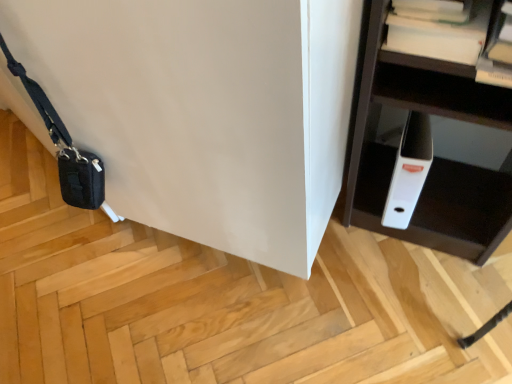
Where is `white paper at upper right`? The height and width of the screenshot is (384, 512). white paper at upper right is located at coordinates (440, 36).

Describe the element at coordinates (440, 36) in the screenshot. The image size is (512, 384). I see `white paper at upper right` at that location.

The width and height of the screenshot is (512, 384). What do you see at coordinates (64, 147) in the screenshot?
I see `black fabric messenger bag at lower left` at bounding box center [64, 147].

Locate an element on the screen. This screenshot has width=512, height=384. black fabric messenger bag at lower left is located at coordinates (64, 147).

What is the approximate width of black fabric messenger bag at lower left?

The width of black fabric messenger bag at lower left is 3.83 inches.

Measure the distance between black fabric messenger bag at lower left and camera.

A distance of 29.37 inches exists between black fabric messenger bag at lower left and camera.

I want to click on white paper at upper right, so click(440, 36).

Is white paper at upper right to the right of black fabric messenger bag at lower left from the viewer's perspective?

Yes, white paper at upper right is to the right of black fabric messenger bag at lower left.

Does white paper at upper right come in front of black fabric messenger bag at lower left?

Yes.

Between point (472, 2) and point (68, 132), which one is positioned in front?

The point (472, 2) is more forward.

From the image's perspective, is white paper at upper right positioned above or below black fabric messenger bag at lower left?

From the image's perspective, white paper at upper right appears above black fabric messenger bag at lower left.

From a real-world perspective, is white paper at upper right located higher than black fabric messenger bag at lower left?

Yes, from a real-world perspective, white paper at upper right is on top of black fabric messenger bag at lower left.

Which of these two, white paper at upper right or black fabric messenger bag at lower left, is wider?

white paper at upper right.

Consider the image. Considering the relative sizes of white paper at upper right and black fabric messenger bag at lower left in the image provided, is white paper at upper right taller than black fabric messenger bag at lower left?

Incorrect, the height of white paper at upper right is not larger of that of black fabric messenger bag at lower left.

Can you confirm if white paper at upper right is smaller than black fabric messenger bag at lower left?

Yes, white paper at upper right is smaller than black fabric messenger bag at lower left.

Based on the photo, can black fabric messenger bag at lower left be found inside white paper at upper right?

That's incorrect, black fabric messenger bag at lower left is not inside white paper at upper right.

Is there a large distance between white paper at upper right and black fabric messenger bag at lower left?

No, white paper at upper right is not far away from black fabric messenger bag at lower left.

Is white paper at upper right aimed at black fabric messenger bag at lower left?

No, white paper at upper right is not oriented towards black fabric messenger bag at lower left.

What's the angular difference between white paper at upper right and black fabric messenger bag at lower left's facing directions?

The angle between the facing direction of white paper at upper right and the facing direction of black fabric messenger bag at lower left is 24 degrees.

Find the location of a particular element. This screenshot has height=384, width=512. messenger bag located on the left of white paper at upper right is located at coordinates (64, 147).

Does black fabric messenger bag at lower left appear on the left side of white paper at upper right?

Yes.

Is black fabric messenger bag at lower left positioned before white paper at upper right?

No, the depth of black fabric messenger bag at lower left is greater than that of white paper at upper right.

Considering the points (48, 121) and (417, 32), which point is behind, point (48, 121) or point (417, 32)?

The point (48, 121) is farther from the camera.

From the image's perspective, which one is positioned lower, black fabric messenger bag at lower left or white paper at upper right?

black fabric messenger bag at lower left is shown below in the image.

From a real-world perspective, which object rests below the other?

In real-world perspective, black fabric messenger bag at lower left is lower.

Is black fabric messenger bag at lower left thinner than white paper at upper right?

Yes.

Does black fabric messenger bag at lower left have a greater height compared to white paper at upper right?

Yes.

Can you confirm if black fabric messenger bag at lower left is smaller than white paper at upper right?

No, black fabric messenger bag at lower left is not smaller than white paper at upper right.

Would you say black fabric messenger bag at lower left is inside or outside white paper at upper right?

The correct answer is: outside.

Does black fabric messenger bag at lower left touch white paper at upper right?

black fabric messenger bag at lower left and white paper at upper right are not in contact.

Is black fabric messenger bag at lower left facing away from white paper at upper right?

No, black fabric messenger bag at lower left is not facing the opposite direction of white paper at upper right.

How far apart are black fabric messenger bag at lower left and white paper at upper right?

A distance of 72.46 centimeters exists between black fabric messenger bag at lower left and white paper at upper right.

Find the location of `messenger bag on the left of white paper at upper right`. messenger bag on the left of white paper at upper right is located at coordinates (64, 147).

This screenshot has width=512, height=384. I want to click on book located above the black fabric messenger bag at lower left (from a real-world perspective), so click(440, 36).

What are the coordinates of `book lying on the right of black fabric messenger bag at lower left` in the screenshot? It's located at (440, 36).